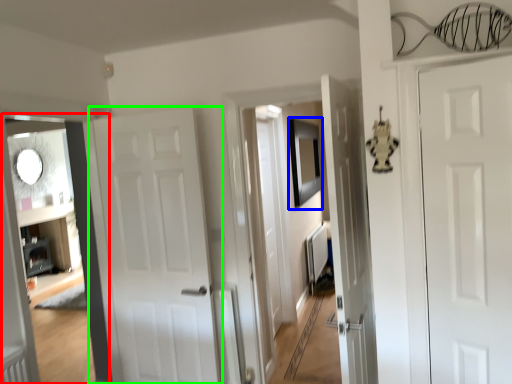
Question: Which is nearer to the corridor (highlighted by a red box)? picture frame (highlighted by a blue box) or door (highlighted by a green box).

Choices:
 (A) picture frame
 (B) door

Answer: (B)